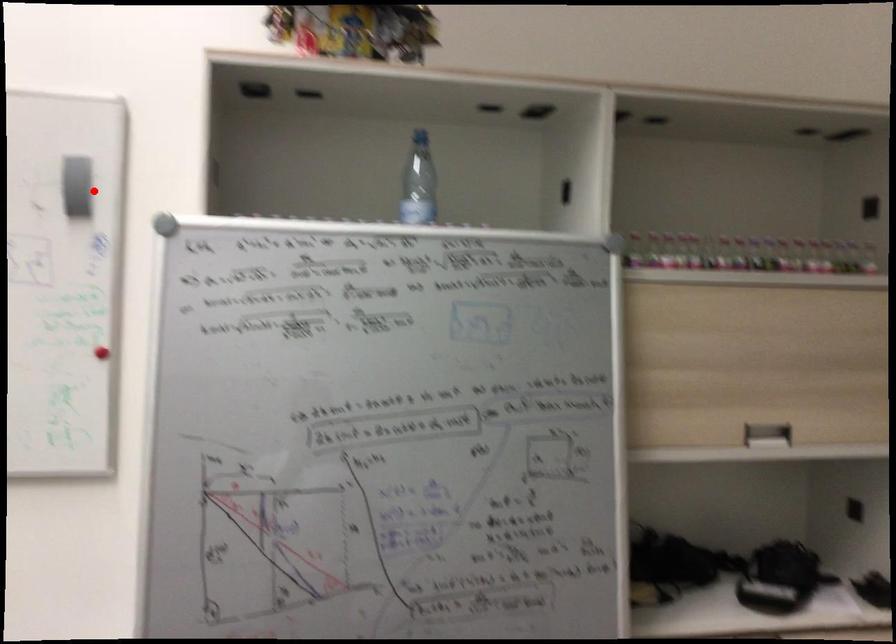
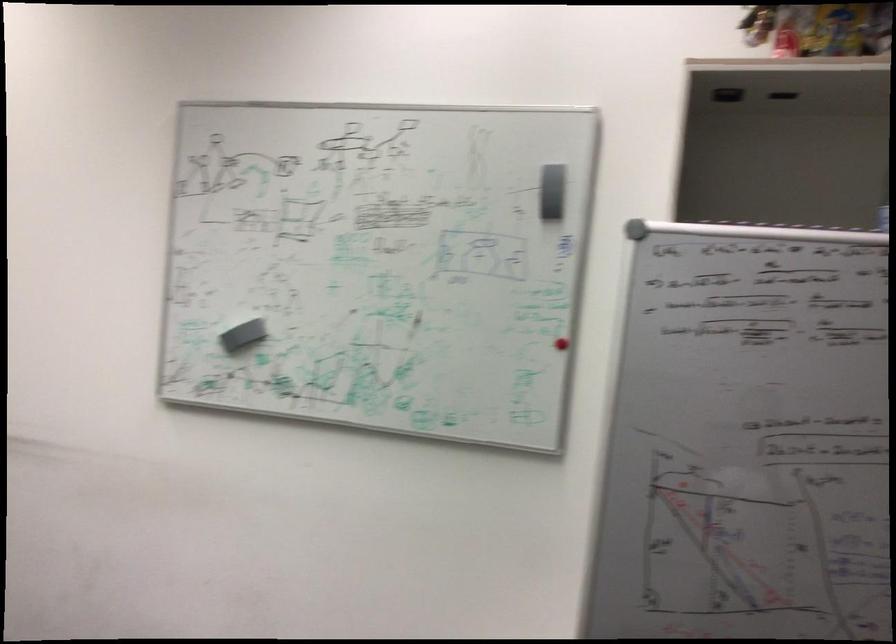
The point at the highlighted location is marked in the first image. Where is the corresponding point in the second image?

(554, 191)